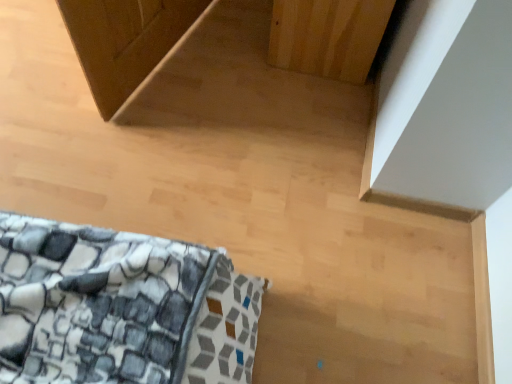
Locate an element on the screen. natural wood cabinet at upper center is located at coordinates (328, 36).

The height and width of the screenshot is (384, 512). Describe the element at coordinates (328, 36) in the screenshot. I see `natural wood cabinet at upper center` at that location.

Where is `natural wood cabinet at upper center`? The width and height of the screenshot is (512, 384). natural wood cabinet at upper center is located at coordinates (328, 36).